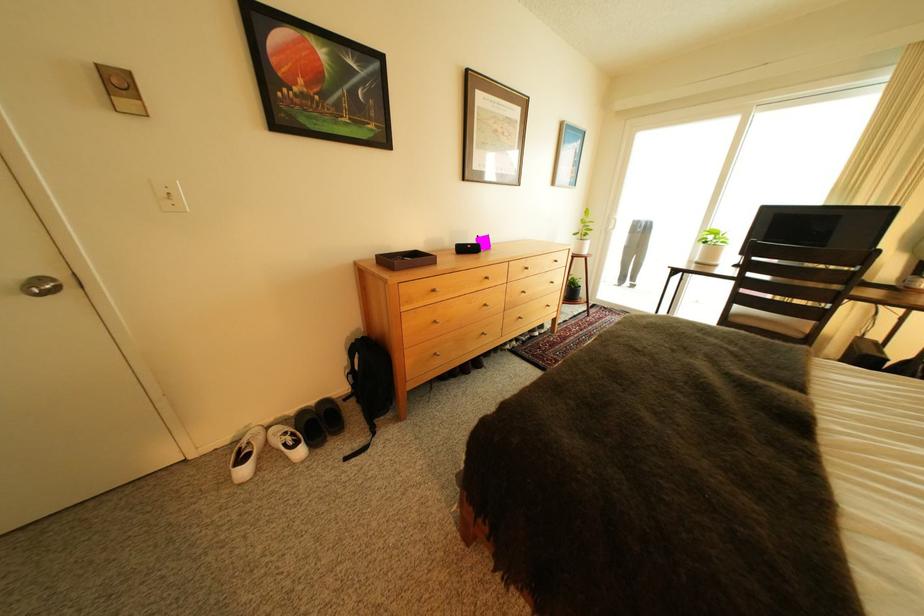
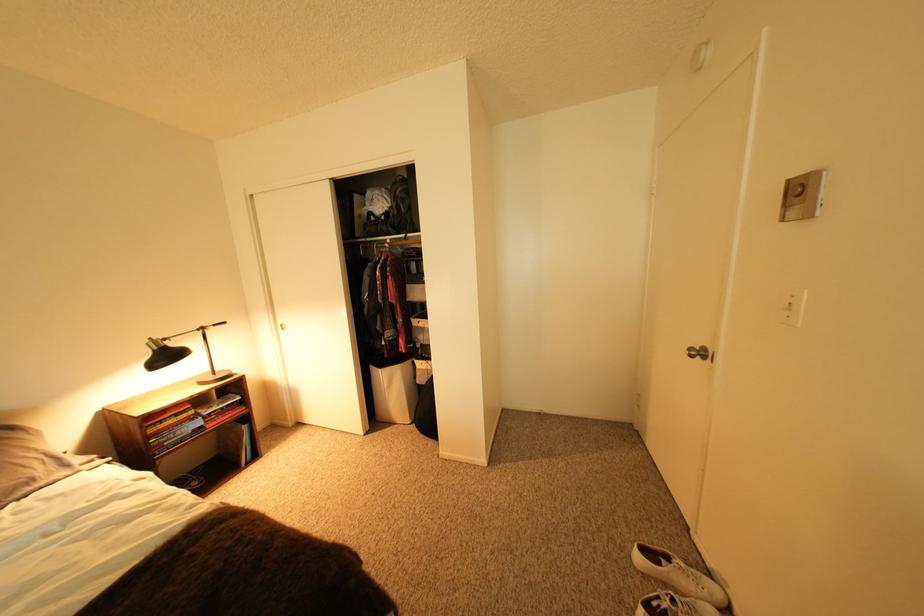
Locate, in the second image, the point that corresponds to (x=257, y=472) in the first image.

(651, 560)